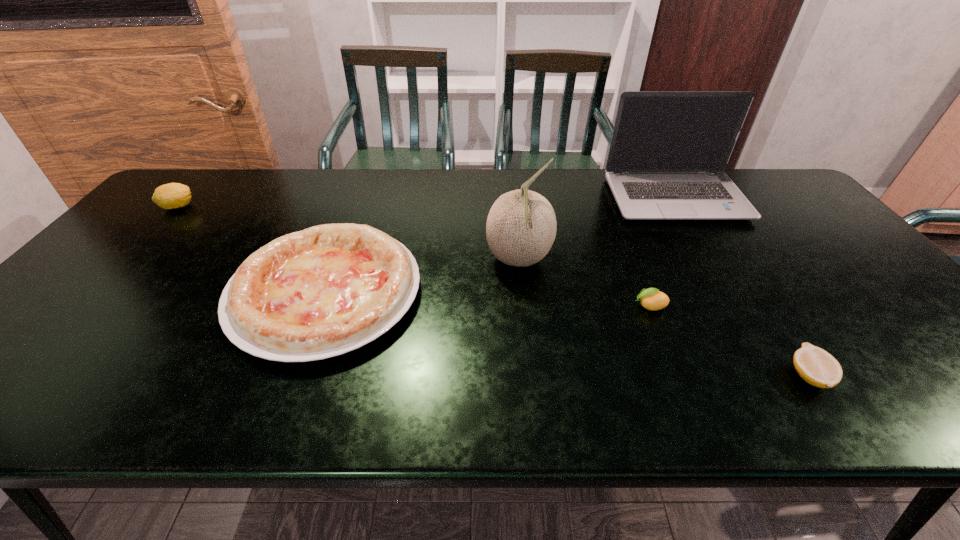
Identify the location of vacant space located 0.220m at the stem end of the tallest lemon. (265, 207).

Find the location of a particular element. Image resolution: width=960 pixels, height=540 pixels. free space located 0.330m with leaves positioned above the second nearest lemon is located at coordinates (495, 306).

Where is `free space located 0.230m with leaves positioned above the second nearest lemon`? The width and height of the screenshot is (960, 540). free space located 0.230m with leaves positioned above the second nearest lemon is located at coordinates point(538,306).

Where is `vacant region located with leaves positioned above the second nearest lemon`? Image resolution: width=960 pixels, height=540 pixels. vacant region located with leaves positioned above the second nearest lemon is located at coordinates (508, 306).

Find the location of a particular element. The height and width of the screenshot is (540, 960). vacant space positioned 0.220m on the right of the nearest lemon is located at coordinates (933, 376).

Find the location of a particular element. The image size is (960, 540). laptop computer at the far edge is located at coordinates (669, 149).

Find the location of a particular element. lemon located in the far edge section of the desktop is located at coordinates (173, 195).

Where is `object at the near edge`? object at the near edge is located at coordinates 817,367.

Locate an element on the screen. This screenshot has height=540, width=960. object present at the left edge is located at coordinates coord(173,195).

Where is `object located at the far left corner`? object located at the far left corner is located at coordinates (173, 195).